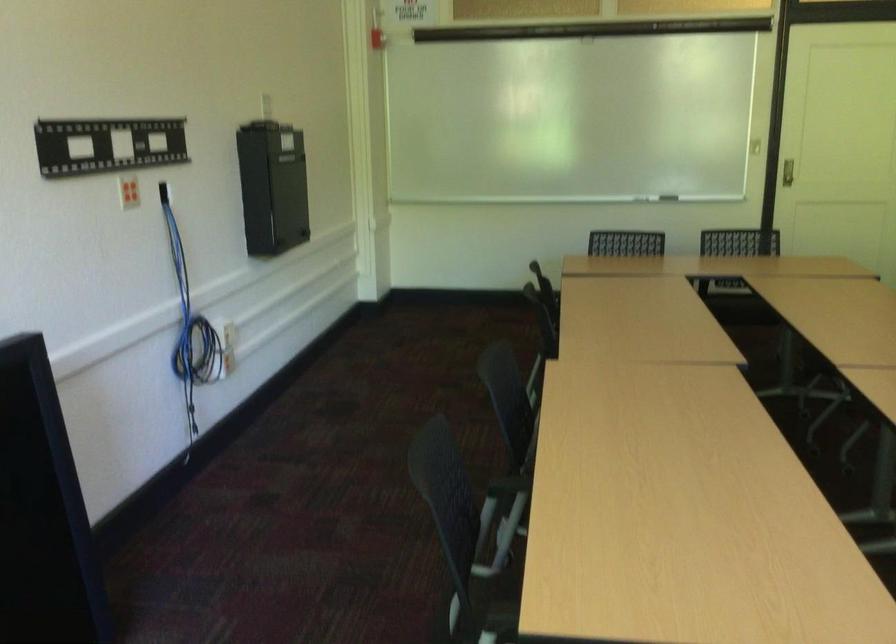
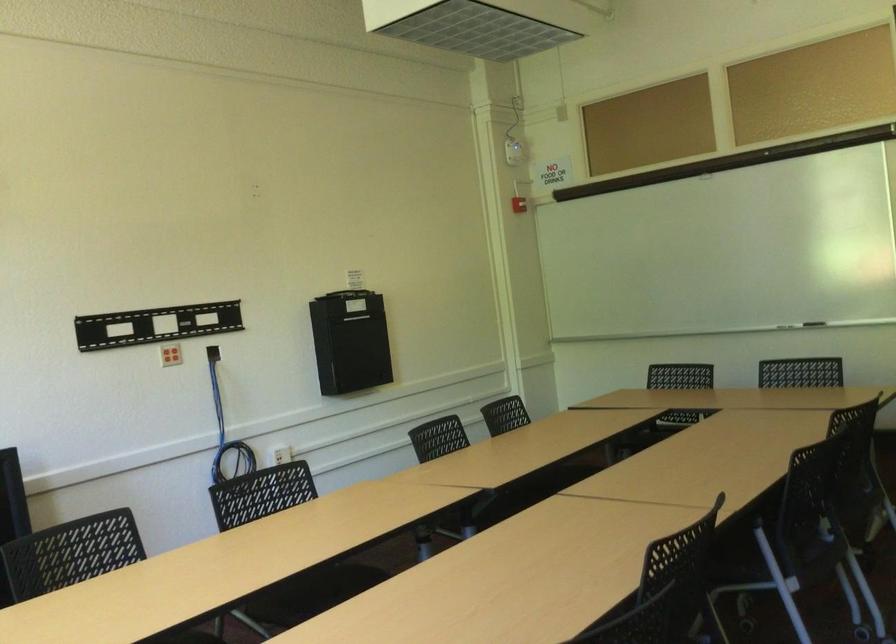
Locate, in the second image, the point that corresponds to (x=188, y=304) in the first image.

(226, 431)